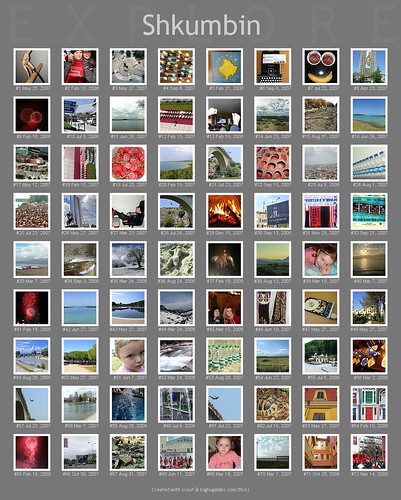
Locate an element on the screen. The width and height of the screenshot is (401, 500). pictures in far right vertical row is located at coordinates click(373, 66), click(368, 115), click(371, 163), click(370, 211), click(375, 258), click(373, 306), click(370, 355), click(369, 402), click(368, 452).